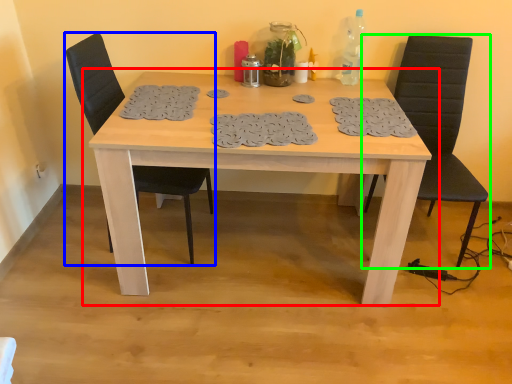
Question: Which object is positioned closest to table (highlighted by a red box)? Select from chair (highlighted by a blue box) and chair (highlighted by a green box).

Choices:
 (A) chair
 (B) chair

Answer: (A)